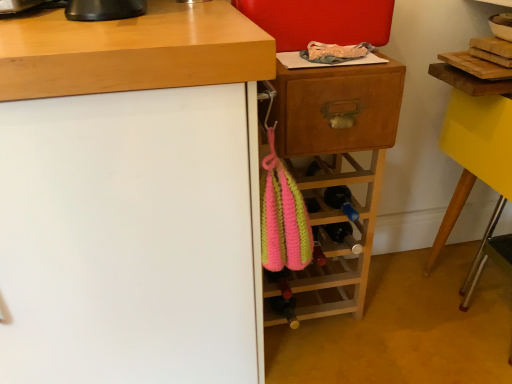
Question: Is yellow glossy table at right not near pink knitted bag at center?

Choices:
 (A) no
 (B) yes

Answer: (A)

Question: From a real-world perspective, is yellow glossy table at right on pink knitted bag at center?

Choices:
 (A) no
 (B) yes

Answer: (B)

Question: From the image's perspective, is yellow glossy table at right beneath pink knitted bag at center?

Choices:
 (A) yes
 (B) no

Answer: (B)

Question: Is yellow glossy table at right completely or partially outside of pink knitted bag at center?

Choices:
 (A) no
 (B) yes

Answer: (B)

Question: Considering the relative sizes of yellow glossy table at right and pink knitted bag at center in the image provided, is yellow glossy table at right shorter than pink knitted bag at center?

Choices:
 (A) no
 (B) yes

Answer: (A)

Question: Are yellow glossy table at right and pink knitted bag at center making contact?

Choices:
 (A) no
 (B) yes

Answer: (A)

Question: Would you say yellow glossy table at right contains pink knitted bottle at center?

Choices:
 (A) yes
 (B) no

Answer: (B)

Question: Is yellow glossy table at right positioned with its back to pink knitted bottle at center?

Choices:
 (A) no
 (B) yes

Answer: (A)

Question: Is yellow glossy table at right in front of pink knitted bottle at center?

Choices:
 (A) yes
 (B) no

Answer: (A)

Question: Can you confirm if yellow glossy table at right is shorter than pink knitted bottle at center?

Choices:
 (A) no
 (B) yes

Answer: (A)

Question: Does yellow glossy table at right lie behind pink knitted bottle at center?

Choices:
 (A) no
 (B) yes

Answer: (A)

Question: From a real-world perspective, is yellow glossy table at right physically above pink knitted bottle at center?

Choices:
 (A) yes
 (B) no

Answer: (A)

Question: Considering the relative positions of white matte cabinet at left and yellow glossy table at right in the image provided, is white matte cabinet at left to the left of yellow glossy table at right from the viewer's perspective?

Choices:
 (A) no
 (B) yes

Answer: (B)